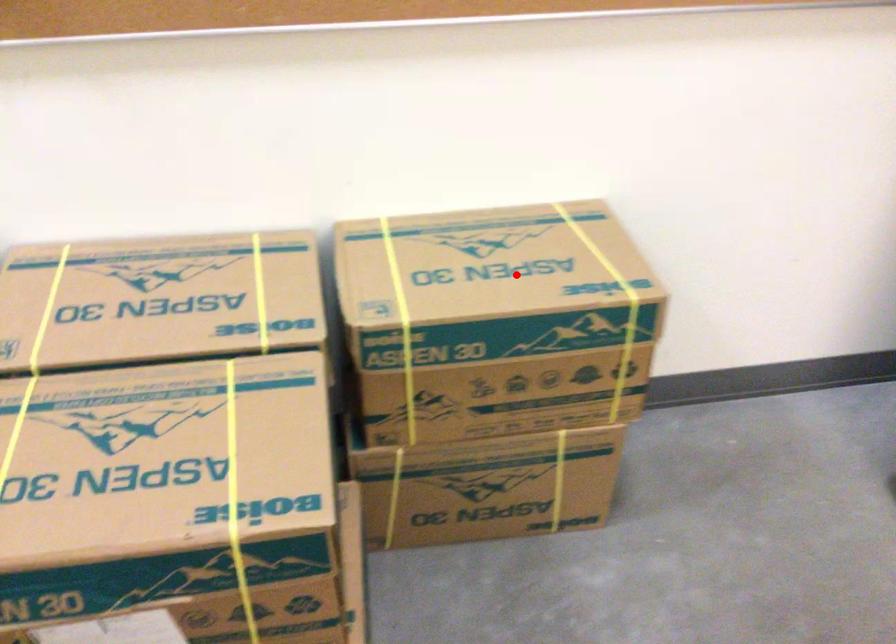
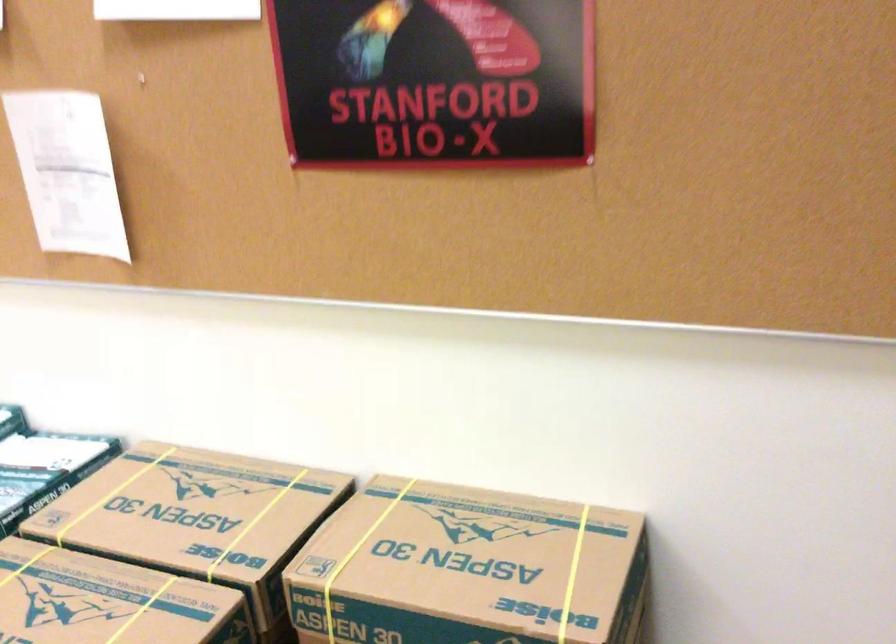
The point at the highlighted location is marked in the first image. Where is the corresponding point in the second image?

(468, 569)